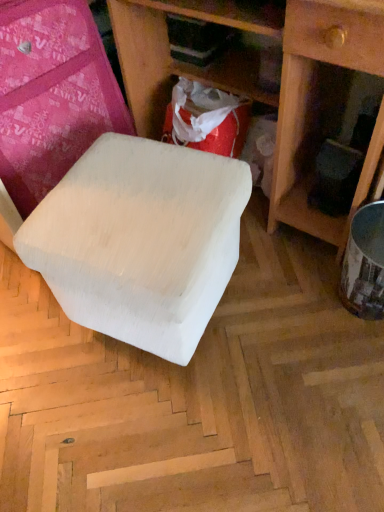
Looking at this image, what is the approximate width of matte white stool at center?

matte white stool at center is 21.05 inches in width.

In order to face matte white stool at center, should I rotate leftwards or rightwards?

Turn right approximately 9.500 degrees to face it.

Locate an element on the screen. Image resolution: width=384 pixels, height=512 pixels. matte white stool at center is located at coordinates (270, 84).

Describe the element at coordinates (270, 84) in the screenshot. The width and height of the screenshot is (384, 512). I see `matte white stool at center` at that location.

Identify the location of white matte stool at center. Image resolution: width=384 pixels, height=512 pixels. (114, 200).

What do you see at coordinates (114, 200) in the screenshot?
I see `white matte stool at center` at bounding box center [114, 200].

At what (x,y) coordinates should I click in order to perform the action: click on matte white stool at center. Please return your answer as a coordinate pair (x, y). This screenshot has width=384, height=512. Looking at the image, I should click on (270, 84).

Visually, is white matte stool at center positioned to the left or to the right of matte white stool at center?

white matte stool at center is positioned on matte white stool at center's left side.

Which is behind, white matte stool at center or matte white stool at center?

white matte stool at center is behind.

Is point (4, 29) behind point (270, 202)?

That is False.

From the image's perspective, is white matte stool at center on top of matte white stool at center?

No, from the image's perspective, white matte stool at center is not over matte white stool at center.

From a real-world perspective, which object rests below the other?

white matte stool at center is physically lower.

Considering the relative sizes of white matte stool at center and matte white stool at center in the image provided, is white matte stool at center thinner than matte white stool at center?

Indeed, white matte stool at center has a lesser width compared to matte white stool at center.

Which of these two, white matte stool at center or matte white stool at center, stands shorter?

With less height is white matte stool at center.

Looking at this image, considering the relative sizes of white matte stool at center and matte white stool at center in the image provided, is white matte stool at center smaller than matte white stool at center?

Indeed, white matte stool at center has a smaller size compared to matte white stool at center.

Is white matte stool at center situated inside matte white stool at center or outside?

white matte stool at center is located beyond the bounds of matte white stool at center.

Is white matte stool at center far away from matte white stool at center?

No, white matte stool at center is not far from matte white stool at center.

Is white matte stool at center oriented towards matte white stool at center?

No, white matte stool at center does not turn towards matte white stool at center.

The width and height of the screenshot is (384, 512). I want to click on shelf above the white matte stool at center (from the image's perspective), so click(270, 84).

Is matte white stool at center to the right of white matte stool at center from the viewer's perspective?

Correct, you'll find matte white stool at center to the right of white matte stool at center.

Which object is closer to the camera taking this photo, matte white stool at center or white matte stool at center?

Positioned in front is matte white stool at center.

Is point (339, 72) behind point (156, 168)?

Yes, point (339, 72) is behind point (156, 168).

From the image's perspective, is matte white stool at center located above white matte stool at center?

Correct, matte white stool at center appears higher than white matte stool at center in the image.

From a real-world perspective, is matte white stool at center located beneath white matte stool at center?

Incorrect, from a real-world perspective, matte white stool at center is higher than white matte stool at center.

Considering the relative sizes of matte white stool at center and white matte stool at center in the image provided, is matte white stool at center thinner than white matte stool at center?

No, matte white stool at center is not thinner than white matte stool at center.

Considering the relative sizes of matte white stool at center and white matte stool at center in the image provided, is matte white stool at center shorter than white matte stool at center?

In fact, matte white stool at center may be taller than white matte stool at center.

Between matte white stool at center and white matte stool at center, which one has smaller size?

white matte stool at center.

Is white matte stool at center inside matte white stool at center?

Definitely not — white matte stool at center is not inside matte white stool at center.

Are matte white stool at center and white matte stool at center far apart?

No, there isn't a large distance between matte white stool at center and white matte stool at center.

Is matte white stool at center facing towards white matte stool at center?

Yes, matte white stool at center is oriented towards white matte stool at center.

Where is `shelf in front of the white matte stool at center`? shelf in front of the white matte stool at center is located at coordinates tap(270, 84).

Where is `furniture behind the matte white stool at center`? This screenshot has height=512, width=384. furniture behind the matte white stool at center is located at coordinates (114, 200).

You are a GUI agent. You are given a task and a screenshot of the screen. Output one action in this format:
    pyautogui.click(x=<x>, y=<y>)
    Task: Click on the shelf lying on the right of white matte stool at center
    
    Given the screenshot: What is the action you would take?
    pyautogui.click(x=270, y=84)